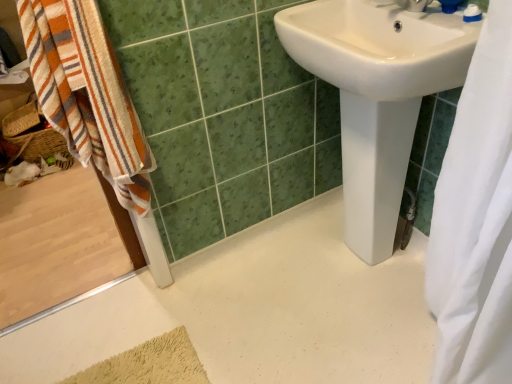
Question: Can you confirm if white glossy sink at center is taller than white plastic toothpaste tube at upper right?

Choices:
 (A) no
 (B) yes

Answer: (B)

Question: Is the depth of white glossy sink at center less than that of white plastic toothpaste tube at upper right?

Choices:
 (A) yes
 (B) no

Answer: (A)

Question: From a real-world perspective, is white glossy sink at center below white plastic toothpaste tube at upper right?

Choices:
 (A) yes
 (B) no

Answer: (A)

Question: Considering the relative sizes of white glossy sink at center and white plastic toothpaste tube at upper right in the image provided, is white glossy sink at center thinner than white plastic toothpaste tube at upper right?

Choices:
 (A) yes
 (B) no

Answer: (B)

Question: Considering the relative sizes of white glossy sink at center and white plastic toothpaste tube at upper right in the image provided, is white glossy sink at center smaller than white plastic toothpaste tube at upper right?

Choices:
 (A) no
 (B) yes

Answer: (A)

Question: Would you say white glossy sink at center is inside or outside white plastic toothpaste tube at upper right?

Choices:
 (A) outside
 (B) inside

Answer: (A)

Question: In terms of height, does white glossy sink at center look taller or shorter compared to white plastic toothpaste tube at upper right?

Choices:
 (A) tall
 (B) short

Answer: (A)

Question: Is white glossy sink at center to the left or to the right of white plastic toothpaste tube at upper right in the image?

Choices:
 (A) left
 (B) right

Answer: (A)

Question: In terms of width, does white glossy sink at center look wider or thinner when compared to white plastic toothpaste tube at upper right?

Choices:
 (A) thin
 (B) wide

Answer: (B)

Question: In terms of width, does white plastic toothpaste tube at upper right look wider or thinner when compared to white fabric shower curtain at right?

Choices:
 (A) thin
 (B) wide

Answer: (A)

Question: Considering the positions of point (476, 14) and point (479, 271), is point (476, 14) closer or farther from the camera than point (479, 271)?

Choices:
 (A) closer
 (B) farther

Answer: (B)

Question: Choose the correct answer: Is white plastic toothpaste tube at upper right inside white fabric shower curtain at right or outside it?

Choices:
 (A) inside
 (B) outside

Answer: (B)

Question: From a real-world perspective, relative to white fabric shower curtain at right, is white plastic toothpaste tube at upper right vertically above or below?

Choices:
 (A) below
 (B) above

Answer: (B)

Question: From a real-world perspective, is white fabric shower curtain at right above or below white plastic toothpaste tube at upper right?

Choices:
 (A) below
 (B) above

Answer: (A)

Question: Looking at their shapes, would you say white fabric shower curtain at right is wider or thinner than white plastic toothpaste tube at upper right?

Choices:
 (A) thin
 (B) wide

Answer: (B)